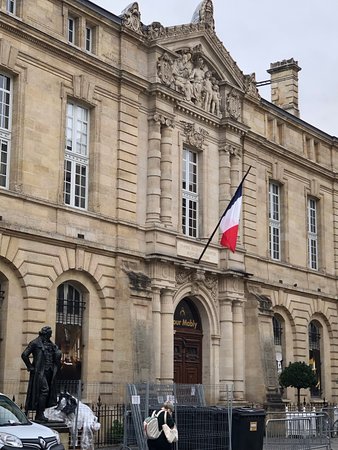
What are the coordinates of `statue` in the screenshot? It's located at (230, 224), (210, 240), (44, 358).